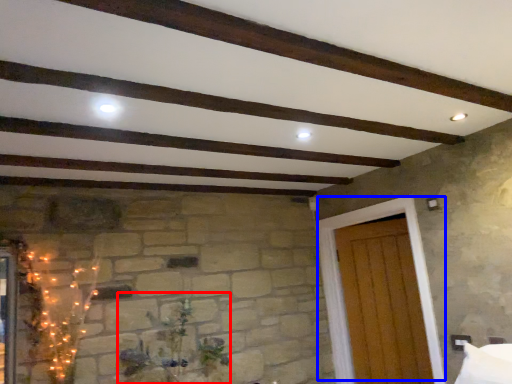
Question: Which object is closer to the camera taking this photo, plant (highlighted by a red box) or door (highlighted by a blue box)?

Choices:
 (A) plant
 (B) door

Answer: (A)